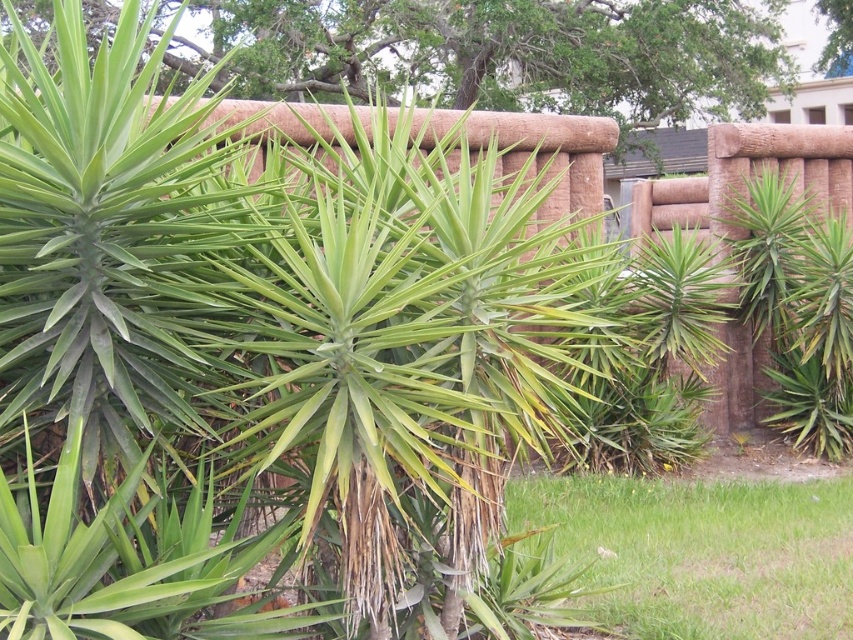
Question: Observing the image, what is the correct spatial positioning of green leafy plant at center in reference to green grass at lower right?

Choices:
 (A) right
 (B) left

Answer: (B)

Question: Which point is closer to the camera?

Choices:
 (A) (717, 544)
 (B) (450, 61)

Answer: (A)

Question: Can you confirm if green leafy plant at center is positioned below green grass at lower right?

Choices:
 (A) yes
 (B) no

Answer: (B)

Question: Is green leafy plant at center further to the viewer compared to green grass at lower right?

Choices:
 (A) no
 (B) yes

Answer: (B)

Question: Which object is closer to the camera taking this photo?

Choices:
 (A) green leafy plant at center
 (B) green grass at lower right

Answer: (B)